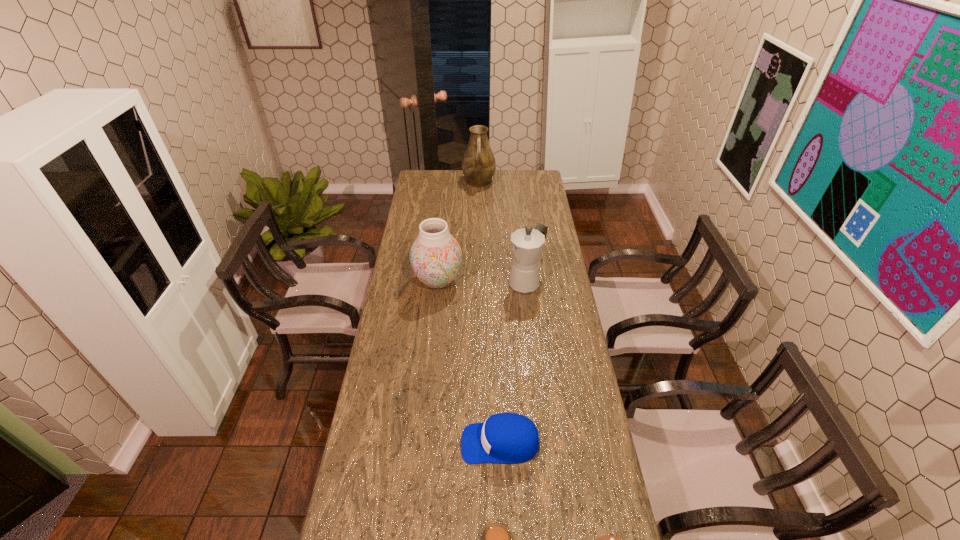
Locate an element on the screen. This screenshot has height=540, width=960. empty location between the vase and the third nearest object is located at coordinates (469, 362).

I want to click on empty space between the pitcher and the coffeepot, so click(x=502, y=232).

Select which object appears as the third closest to the coffeepot. Please provide its 2D coordinates. Your answer should be formatted as a tuple, i.e. [(x, y)], where the tuple contains the x and y coordinates of a point satisfying the conditions above.

[(478, 164)]

At what (x,y) coordinates should I click in order to perform the action: click on object that stands as the second closest to the fifth tallest object. Please return your answer as a coordinate pair (x, y). The image size is (960, 540). Looking at the image, I should click on (508, 438).

At what (x,y) coordinates should I click in order to perform the action: click on free space that satisfies the following two spatial constraints: 1. on the front side of the coffeepot; 2. on the right side of the vase. Please return your answer as a coordinate pair (x, y). This screenshot has width=960, height=540. Looking at the image, I should click on (438, 281).